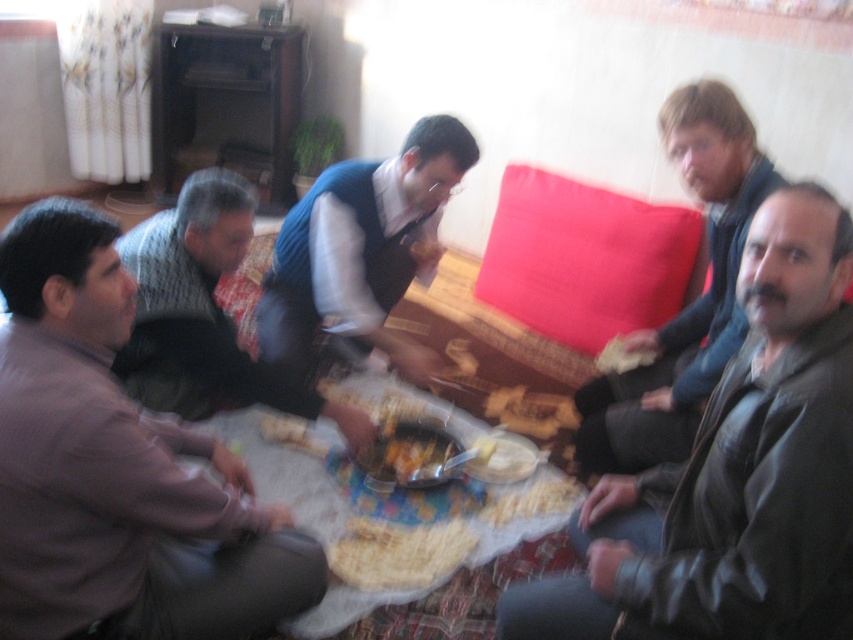
What are the coordinates of the brown textured shirt at left in the image?

The brown textured shirt at left is located at coordinates point (115,468).

You are trying to place a new decorative item on the table. The item is 15 cm wide. You see the knitted sweater at lower left and the shiny plastic bowl at center. Which object should you place the item next to if you want it to fit without overlapping?

The knitted sweater at lower left might be wider than the shiny plastic bowl at center, so placing the item next to the knitted sweater at lower left would be safer to ensure it doesn